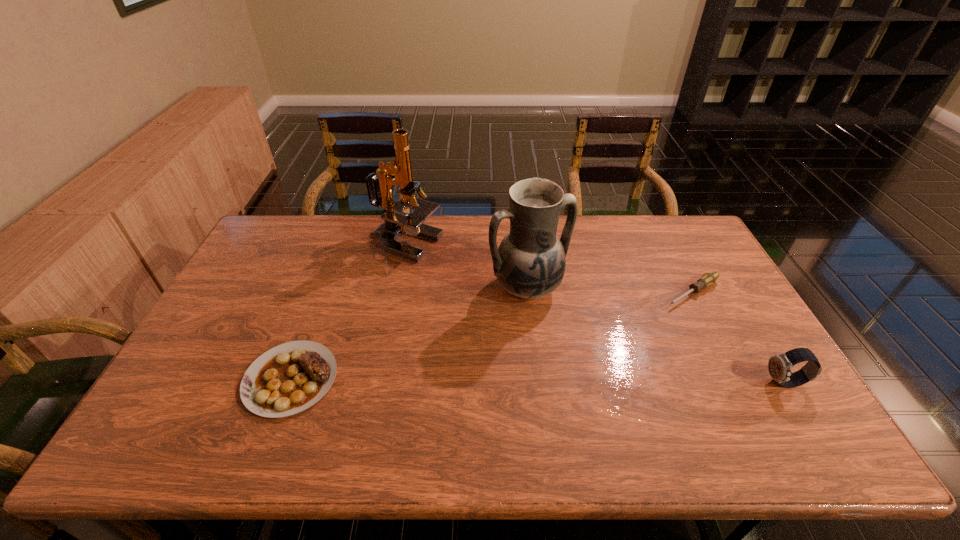
Locate an element on the screen. steak is located at coordinates (289, 378).

The width and height of the screenshot is (960, 540). I want to click on watch, so click(779, 366).

This screenshot has width=960, height=540. Identify the location of pitcher. (530, 262).

This screenshot has height=540, width=960. I want to click on the third object from left to right, so click(530, 262).

I want to click on microscope, so click(397, 223).

You are a GUI agent. You are given a task and a screenshot of the screen. Output one action in this format:
    pyautogui.click(x=<x>, y=<y>)
    Task: Click on the screwdriver
    The width and height of the screenshot is (960, 540).
    Given the screenshot: What is the action you would take?
    pyautogui.click(x=707, y=279)

This screenshot has height=540, width=960. Find the location of `blank area located on the right of the steak`. blank area located on the right of the steak is located at coordinates (492, 379).

Where is `vacant region located 0.210m on the face of the third shortest object`? vacant region located 0.210m on the face of the third shortest object is located at coordinates [684, 383].

This screenshot has width=960, height=540. In order to click on vacant space located on the face of the third shortest object in this screenshot , I will do click(x=684, y=383).

Where is `free spot located on the face of the third shortest object`? free spot located on the face of the third shortest object is located at coordinates (695, 383).